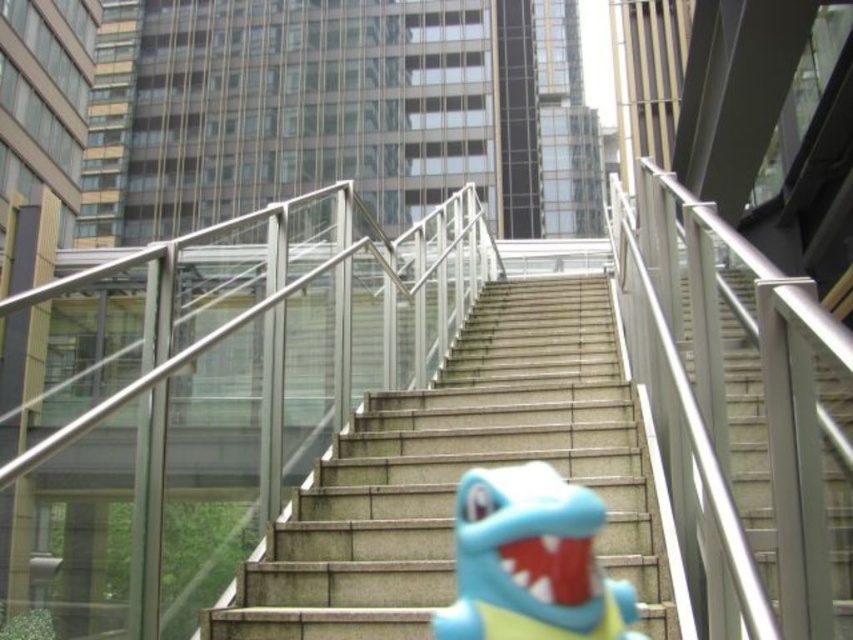
You are a delivery person carrying a large box and need to navigate the metallic silver railing at center and the concrete stairs at center. Which object is taller and requires more caution when passing by?

The metallic silver railing at center is much taller than the concrete stairs at center, so it requires more caution when passing by.

You are a delivery robot that needs to navigate through the space between the metallic silver railing at center and the satin silver stairs at center. Given that your body is 0.5 meters wide, can you fit through the space between them?

The metallic silver railing at center is thinner than the satin silver stairs at center, so the space between them is at least as wide as the railing. Since the robot is 0.5 meters wide, it can fit through the space between the metallic silver railing at center and the satin silver stairs at center provided the total width is sufficient.

You are a delivery person carrying a large box that is 6 feet long. You need to navigate through the space between the metallic silver railing at center and the satin silver stairs at center. Can you fit the box through this space without tilting it?

The space between the metallic silver railing at center and the satin silver stairs at center is 5.74 feet. Since the box is 6 feet long, it is slightly longer than the available space, so the box cannot fit through without tilting or adjusting its position.